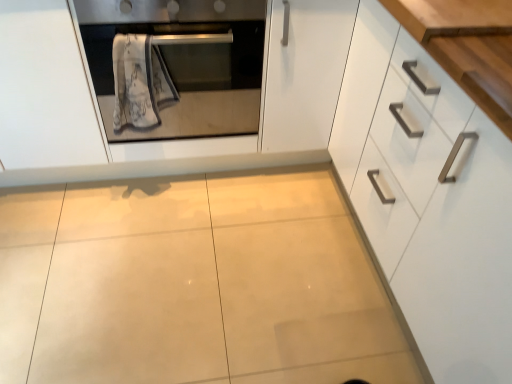
Question: Is white textured towel at center in front of or behind satin silver oven at upper left in the image?

Choices:
 (A) behind
 (B) front

Answer: (A)

Question: Is white textured towel at center bigger or smaller than satin silver oven at upper left?

Choices:
 (A) big
 (B) small

Answer: (B)

Question: Estimate the real-world distances between objects in this image. Which object is closer to the white textured towel at center?

Choices:
 (A) white glossy cabinet at right
 (B) wooden at upper right
 (C) satin silver oven at upper left

Answer: (C)

Question: Which of these objects is positioned closest to the satin silver oven at upper left?

Choices:
 (A) white textured towel at center
 (B) wooden at upper right
 (C) white glossy cabinet at right

Answer: (A)